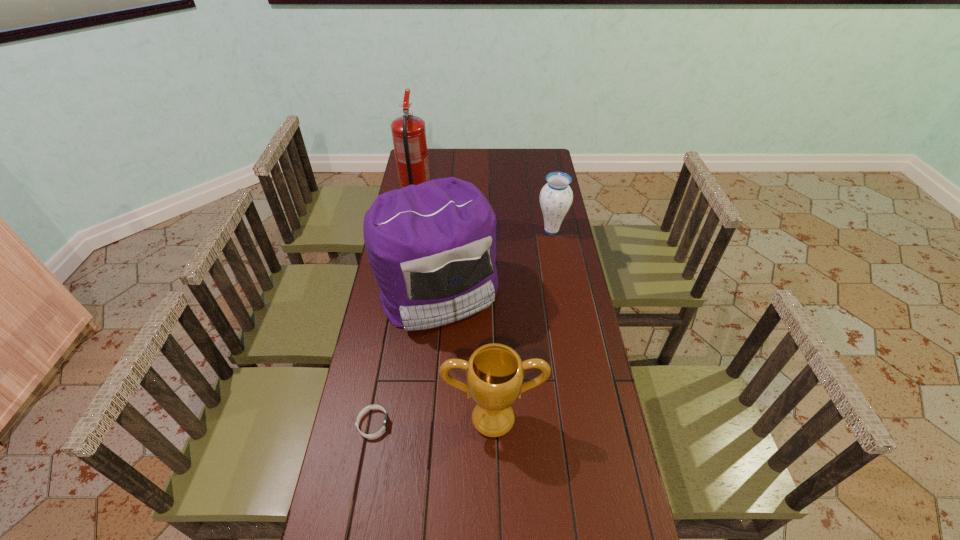
Where is `blank area located on the handle side the farthest object`? The height and width of the screenshot is (540, 960). blank area located on the handle side the farthest object is located at coordinates (421, 187).

The image size is (960, 540). In order to click on vacant region located 0.170m on the front pocket of the backpack in this screenshot , I will do `click(430, 388)`.

Find the location of `vacant space located on the front of the award with the decoration`. vacant space located on the front of the award with the decoration is located at coordinates (494, 465).

This screenshot has width=960, height=540. Find the location of `vacant space located on the back of the second farthest object`. vacant space located on the back of the second farthest object is located at coordinates tap(548, 214).

Locate an element on the screen. This screenshot has width=960, height=540. vacant space located 0.160m on the outer surface of the wristband is located at coordinates (445, 424).

This screenshot has height=540, width=960. What are the coordinates of `fire extinguisher located at the left edge` in the screenshot? It's located at (408, 132).

Locate an element on the screen. The height and width of the screenshot is (540, 960). backpack that is at the left edge is located at coordinates (432, 247).

Where is `wristband located in the left edge section of the desktop`? wristband located in the left edge section of the desktop is located at coordinates (386, 419).

The width and height of the screenshot is (960, 540). What are the coordinates of `object that is at the right edge` in the screenshot? It's located at (556, 197).

The image size is (960, 540). I want to click on free space at the far edge, so click(x=450, y=154).